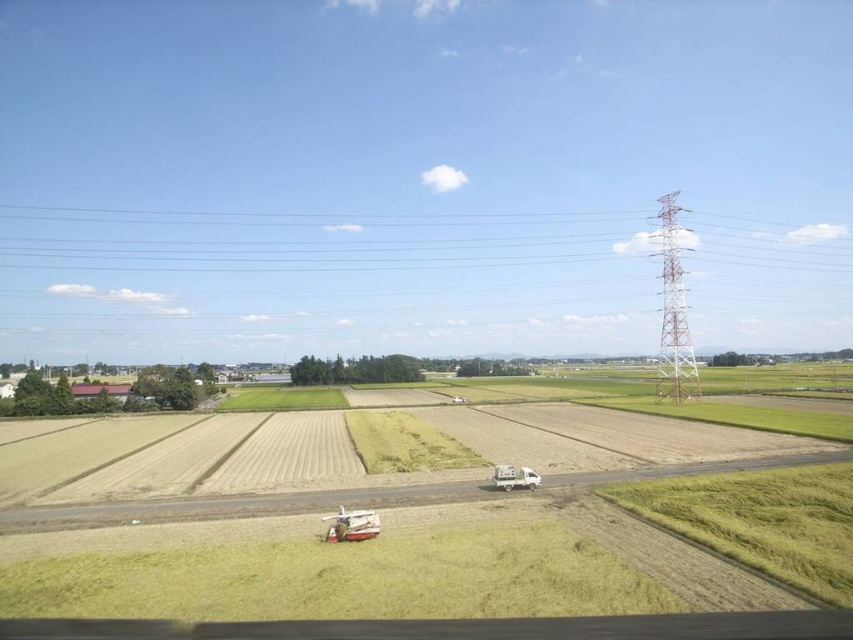
Question: Is smooth wire power line at upper center wider than white matte trailer truck at center?

Choices:
 (A) yes
 (B) no

Answer: (A)

Question: Which point is farther from the camera taking this photo?

Choices:
 (A) (648, 536)
 (B) (521, 472)
 (C) (161, 212)

Answer: (C)

Question: Is green grassy field at center to the right of white matte trailer truck at center from the viewer's perspective?

Choices:
 (A) no
 (B) yes

Answer: (B)

Question: Where is smooth wire power line at upper center located in relation to white matte trailer truck at center in the image?

Choices:
 (A) above
 (B) below

Answer: (A)

Question: Which of these objects is positioned farthest from the green grassy field at center?

Choices:
 (A) smooth wire power line at upper center
 (B) white matte trailer truck at center

Answer: (A)

Question: Which point appears closest to the camera in this image?

Choices:
 (A) (498, 465)
 (B) (438, 406)

Answer: (A)